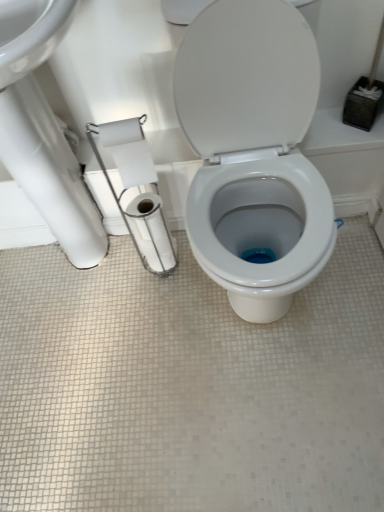
Question: Should I look upward or downward to see white glossy toilet paper at center, which ranks as the third toilet paper in front-to-back order?

Choices:
 (A) up
 (B) down

Answer: (A)

Question: Should I look upward or downward to see white glossy toilet at center?

Choices:
 (A) down
 (B) up

Answer: (B)

Question: Does white matte toilet paper at left, which is counted as the second toilet paper, starting from the back, appear on the right side of white glossy toilet paper at center, which ranks as the third toilet paper in front-to-back order?

Choices:
 (A) yes
 (B) no

Answer: (B)

Question: From the image's perspective, does white matte toilet paper at left, the second toilet paper in the front-to-back sequence, appear higher than white glossy toilet paper at center, which ranks as the third toilet paper in front-to-back order?

Choices:
 (A) yes
 (B) no

Answer: (A)

Question: Is white matte toilet paper at left, which is counted as the second toilet paper, starting from the back, aimed at white glossy toilet paper at center, arranged as the first toilet paper when viewed from the back?

Choices:
 (A) yes
 (B) no

Answer: (B)

Question: Is white matte toilet paper at left, which is counted as the second toilet paper, starting from the back, smaller than white glossy toilet paper at center, arranged as the first toilet paper when viewed from the back?

Choices:
 (A) yes
 (B) no

Answer: (A)

Question: Does white matte toilet paper at left, which is counted as the second toilet paper, starting from the back, touch white glossy toilet paper at center, which ranks as the third toilet paper in front-to-back order?

Choices:
 (A) yes
 (B) no

Answer: (B)

Question: Does white matte toilet paper at left, the second toilet paper in the front-to-back sequence, come behind white glossy toilet paper at center, which ranks as the third toilet paper in front-to-back order?

Choices:
 (A) yes
 (B) no

Answer: (B)

Question: Is white matte toilet paper at left, which is counted as the second toilet paper, starting from the back, positioned with its back to white glossy toilet at center?

Choices:
 (A) no
 (B) yes

Answer: (A)

Question: Is white matte toilet paper at left, which is counted as the second toilet paper, starting from the back, positioned in front of white glossy toilet at center?

Choices:
 (A) yes
 (B) no

Answer: (B)

Question: Considering the relative sizes of white matte toilet paper at left, which is counted as the second toilet paper, starting from the back, and white glossy toilet at center in the image provided, is white matte toilet paper at left, which is counted as the second toilet paper, starting from the back, wider than white glossy toilet at center?

Choices:
 (A) yes
 (B) no

Answer: (B)

Question: Considering the relative positions of white matte toilet paper at left, the second toilet paper in the front-to-back sequence, and white glossy toilet at center in the image provided, is white matte toilet paper at left, the second toilet paper in the front-to-back sequence, to the right of white glossy toilet at center from the viewer's perspective?

Choices:
 (A) no
 (B) yes

Answer: (A)

Question: Is white matte toilet paper at left, which is counted as the second toilet paper, starting from the back, not within white glossy toilet at center?

Choices:
 (A) no
 (B) yes

Answer: (B)

Question: Can you confirm if white matte toilet paper at left, the second toilet paper in the front-to-back sequence, is thinner than white glossy toilet at center?

Choices:
 (A) no
 (B) yes

Answer: (B)

Question: Is white glossy toilet paper at center, arranged as the first toilet paper when viewed from the back, positioned in front of white glossy sink at upper left?

Choices:
 (A) yes
 (B) no

Answer: (B)